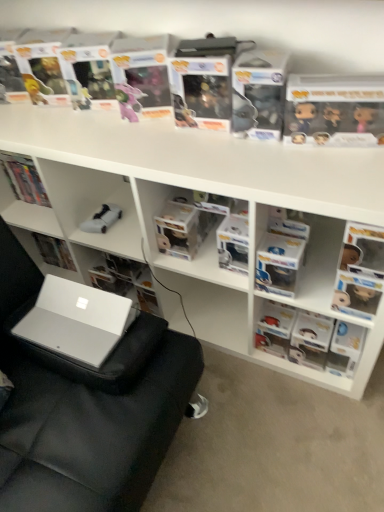
This screenshot has width=384, height=512. Identify the location of free space on the front side of matte black figurine at upper right, which is the 2th paperback book from left to right. (x=352, y=170).